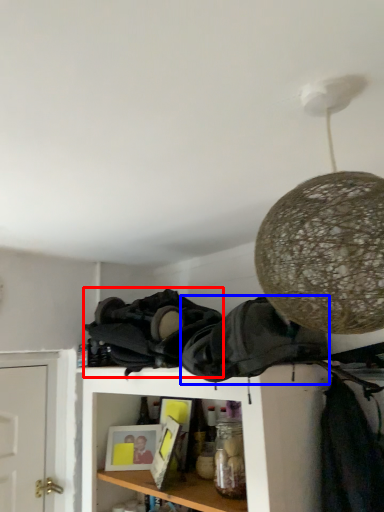
Question: Which object is further to the camera taking this photo, clothing (highlighted by a red box) or clothing (highlighted by a blue box)?

Choices:
 (A) clothing
 (B) clothing

Answer: (A)